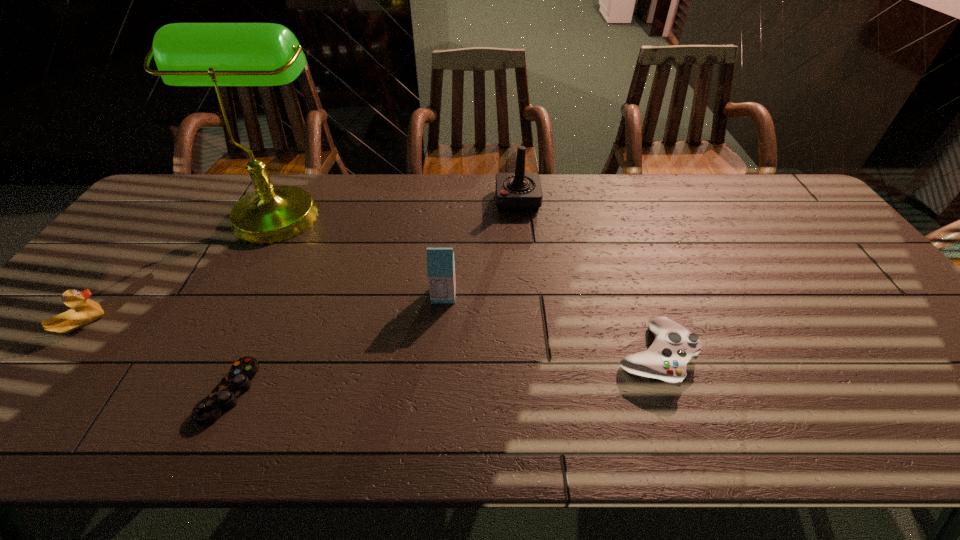
At what (x,y) coordinates should I click in order to perform the action: click on vacant space that satisfies the following two spatial constraints: 1. on the desk next to the tallest object; 2. on the back side of the taller control. Please return your answer as a coordinate pair (x, y). The image size is (960, 540). Looking at the image, I should click on (202, 356).

Where is `free region that satisfies the following two spatial constraints: 1. on the back side of the second shortest object; 2. at the beak of the duck`? The width and height of the screenshot is (960, 540). free region that satisfies the following two spatial constraints: 1. on the back side of the second shortest object; 2. at the beak of the duck is located at coordinates (644, 324).

The height and width of the screenshot is (540, 960). Identify the location of free spot that satisfies the following two spatial constraints: 1. on the desk next to the lamp; 2. on the back side of the shorter control. (182, 392).

This screenshot has height=540, width=960. Find the location of `free space that satisfies the following two spatial constraints: 1. on the back side of the second shortest object; 2. at the beak of the fourth tallest object`. free space that satisfies the following two spatial constraints: 1. on the back side of the second shortest object; 2. at the beak of the fourth tallest object is located at coordinates (644, 324).

Where is `vacant area in the image that satisfies the following two spatial constraints: 1. on the desk next to the tallest object; 2. on the back side of the third object from right to left`? The width and height of the screenshot is (960, 540). vacant area in the image that satisfies the following two spatial constraints: 1. on the desk next to the tallest object; 2. on the back side of the third object from right to left is located at coordinates click(234, 295).

You are a GUI agent. You are given a task and a screenshot of the screen. Output one action in this format:
    pyautogui.click(x=<x>, y=<y>)
    Task: Click on the blank area in the image that satisfies the following two spatial constraints: 1. on the desk next to the tallest object; 2. on the right side of the left control
    The width and height of the screenshot is (960, 540).
    Given the screenshot: What is the action you would take?
    pyautogui.click(x=182, y=392)

Identify the location of vacant region that satisfies the following two spatial constraints: 1. on the front-facing side of the fifth shortest object; 2. on the left side of the rightmost object. The image size is (960, 540). pos(534,356).

I want to click on free location that satisfies the following two spatial constraints: 1. on the front-facing side of the fifth shortest object; 2. on the back side of the rightmost object, so click(x=534, y=356).